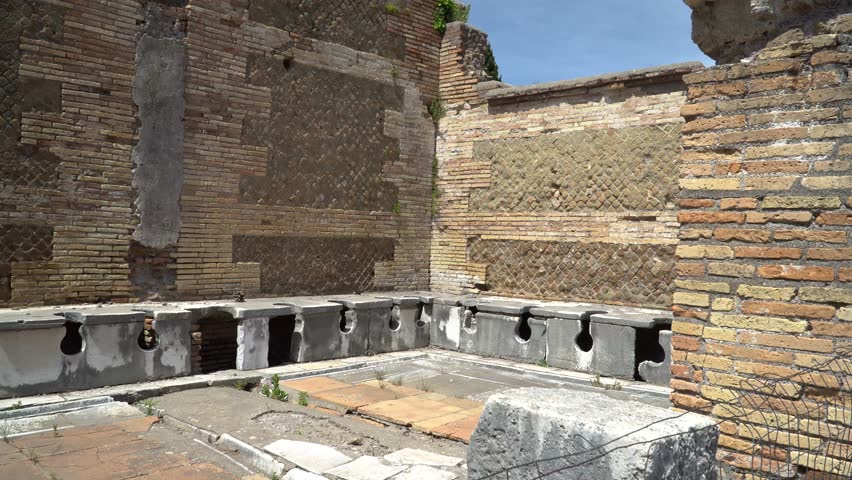
The width and height of the screenshot is (852, 480). Identify the location of plant. (300, 401).